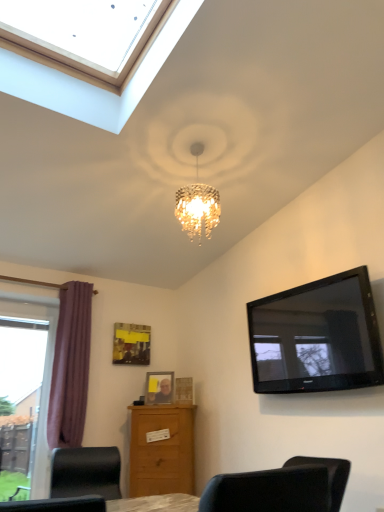
Find the location of a particular element. empty space that is ontop of transparent glass window at left is located at coordinates (33, 323).